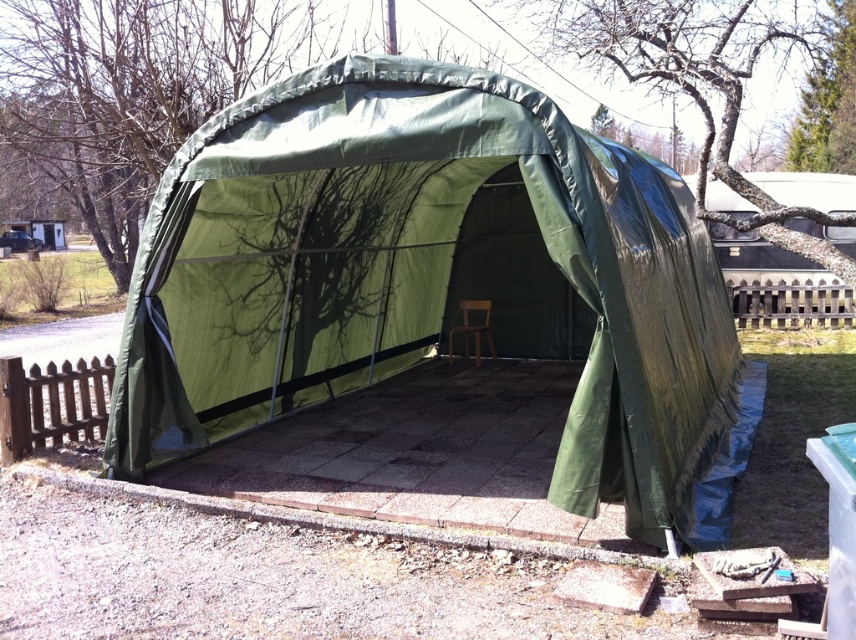
You are planning to place a new small table inside the green fabric tent at center. Considering the size of the tent and the existing brown matte chair at center, do you think there is enough space to accommodate both the chair and the table comfortably?

The green fabric tent at center is larger in size than the brown matte chair at center, so there should be enough space to place both the chair and the table comfortably inside the tent.

You are standing in the backyard and want to reach a specific point marked at coordinates point (664, 529). The structure is between you and that point. Is the structure blocking your path to the point?

The distance of point (664, 529) from viewer is 4.32 meters. Since the structure is between you and the point, it would block your path to the point unless there is a way around or through it. However, the description does not provide information about the structure obstructing the path, so we cannot confirm if it is blocking the path based solely on the given data.

You are standing outside the green fabric tent at center and want to locate the brown matte chair at center. Which direction should you face to see it?

The brown matte chair at center is to the left of the green fabric tent at center, so you should face left to see it.